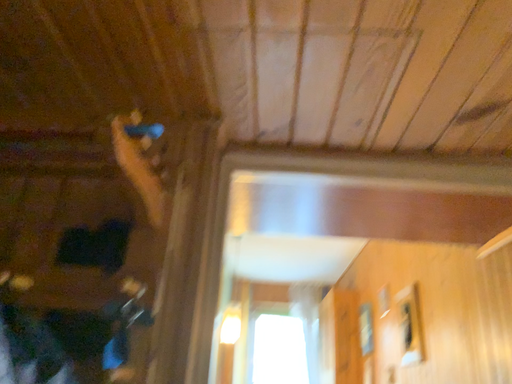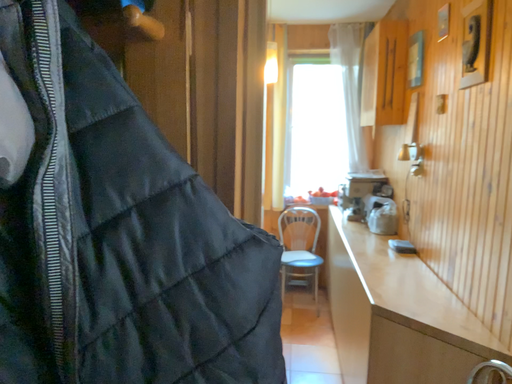
Question: How did the camera likely rotate when shooting the video?

Choices:
 (A) rotated upward
 (B) rotated downward

Answer: (B)